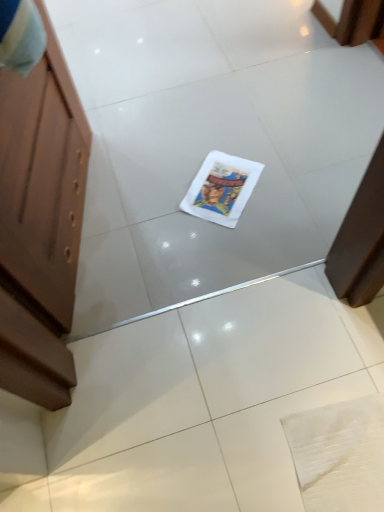
Find the location of a particular element. vacant area that is situated to the right of white paper comic book at center is located at coordinates (293, 179).